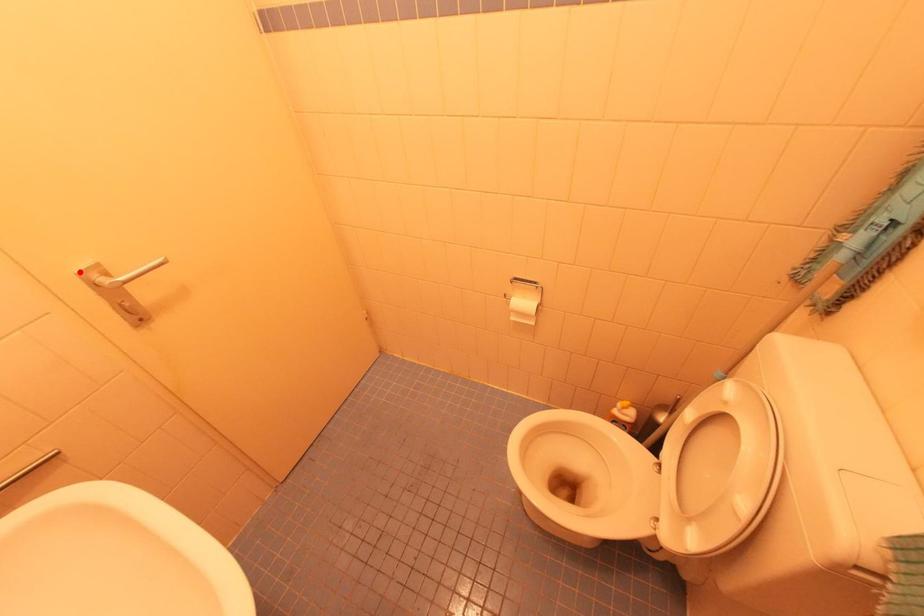
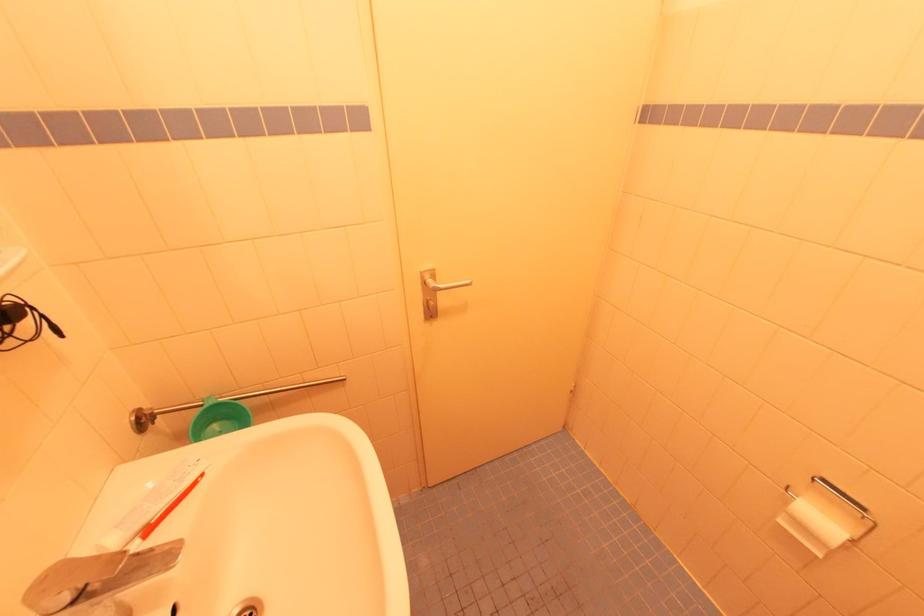
The point at the highlighted location is marked in the first image. Where is the corresponding point in the second image?

(423, 272)